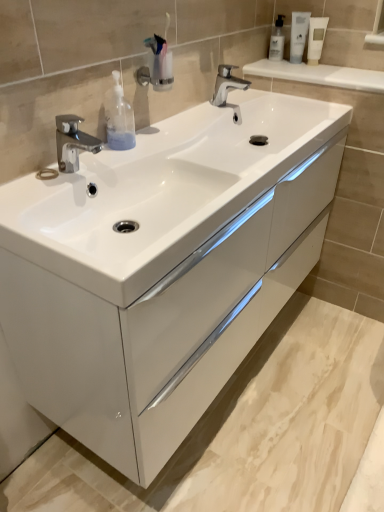
I want to click on unoccupied area in front of white glossy tube at upper right, which appears as the 2th mouthwash when viewed from the left, so click(302, 73).